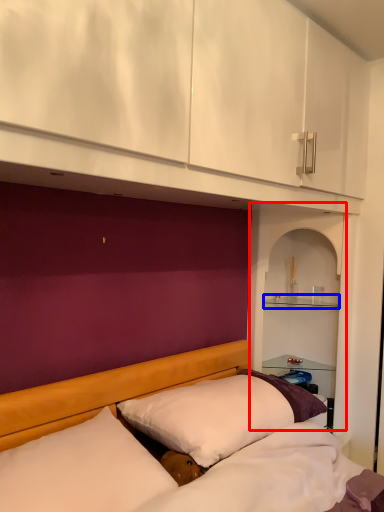
Question: Which object is further to the camera taking this photo, shelf (highlighted by a red box) or shelf (highlighted by a blue box)?

Choices:
 (A) shelf
 (B) shelf

Answer: (B)